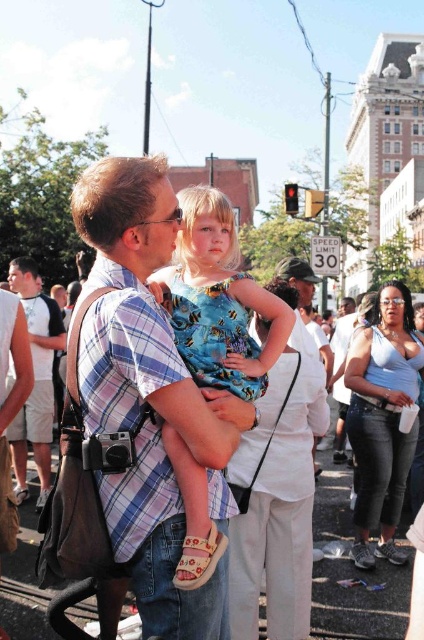
You are standing at the position of the man in the scene. You want to take a photo of the tall buildings with your camera. Since the plaid shirt at center is in front of you, will it block your view of the camera?

The plaid shirt at center is 173.10 feet away from the camera. Since the shirt is much farther away than the camera itself, it won t block the view because distance plays a role in visibility obstruction.

You are a photographer trying to position your camera to capture the matte blue tank top at center. According to the coordinates provided, where exactly should you aim your camera?

The matte blue tank top at center is located at point (382,419), so aim your camera there to capture it.

You are standing at point (41, 314) and want to walk to point (203, 349). Which direction should you move?

You should move forward because point (203, 349) is in front of point (41, 314).